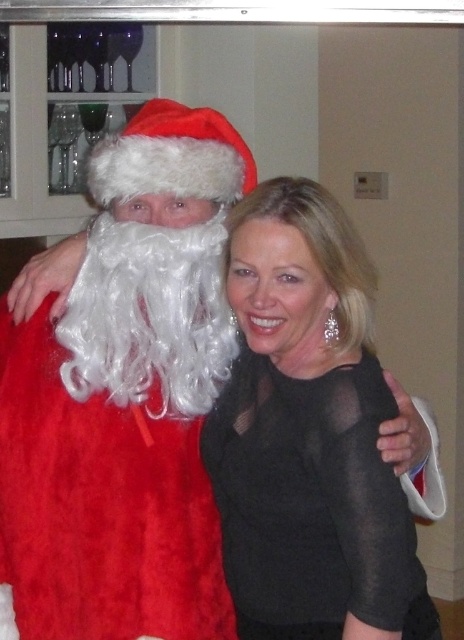
Is fuzzy red santa at left positioned at the back of black sheer dress at center?

Yes, fuzzy red santa at left is behind black sheer dress at center.

Between fuzzy red santa at left and black sheer dress at center, which one is positioned lower?

Positioned lower is black sheer dress at center.

Who is more distant from viewer, (168, 145) or (341, 330)?

Positioned behind is point (168, 145).

Identify the location of fuzzy red santa at left. (124, 400).

Which of these two, black sheer dress at center or fuzzy red santa hat at upper left, stands taller?

black sheer dress at center

Which is above, black sheer dress at center or fuzzy red santa hat at upper left?

fuzzy red santa hat at upper left

Which is behind, point (394, 596) or point (210, 170)?

Positioned behind is point (210, 170).

The height and width of the screenshot is (640, 464). Identify the location of black sheer dress at center. (309, 435).

Is fuzzy red santa at left shorter than fuzzy red santa hat at upper left?

In fact, fuzzy red santa at left may be taller than fuzzy red santa hat at upper left.

Who is positioned more to the right, fuzzy red santa at left or fuzzy red santa hat at upper left?

Positioned to the right is fuzzy red santa hat at upper left.

Does point (225, 150) come farther from viewer compared to point (97, 173)?

Yes, it is.

Find the location of a particular element. The width and height of the screenshot is (464, 640). fuzzy red santa at left is located at coordinates (124, 400).